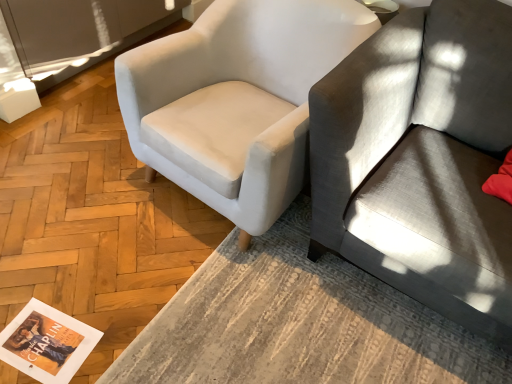
Question: Is gray fabric couch at right taller than textured gray rug at lower center?

Choices:
 (A) no
 (B) yes

Answer: (B)

Question: Is gray fabric couch at right thinner than textured gray rug at lower center?

Choices:
 (A) yes
 (B) no

Answer: (A)

Question: From the image's perspective, is gray fabric couch at right above textured gray rug at lower center?

Choices:
 (A) no
 (B) yes

Answer: (B)

Question: Is gray fabric couch at right positioned behind textured gray rug at lower center?

Choices:
 (A) no
 (B) yes

Answer: (A)

Question: Considering the relative positions of gray fabric couch at right and textured gray rug at lower center in the image provided, is gray fabric couch at right to the left of textured gray rug at lower center from the viewer's perspective?

Choices:
 (A) yes
 (B) no

Answer: (B)

Question: Are gray fabric couch at right and textured gray rug at lower center located far from each other?

Choices:
 (A) yes
 (B) no

Answer: (B)

Question: Can you see white fabric chair at upper left touching textured gray rug at lower center?

Choices:
 (A) yes
 (B) no

Answer: (B)

Question: Is white fabric chair at upper left taller than textured gray rug at lower center?

Choices:
 (A) no
 (B) yes

Answer: (B)

Question: Is white fabric chair at upper left positioned before textured gray rug at lower center?

Choices:
 (A) no
 (B) yes

Answer: (A)

Question: Is white fabric chair at upper left outside of textured gray rug at lower center?

Choices:
 (A) no
 (B) yes

Answer: (B)

Question: From a real-world perspective, is white fabric chair at upper left on textured gray rug at lower center?

Choices:
 (A) no
 (B) yes

Answer: (B)

Question: Can you confirm if white fabric chair at upper left is thinner than textured gray rug at lower center?

Choices:
 (A) no
 (B) yes

Answer: (B)

Question: Does textured gray rug at lower center have a lesser height compared to matte paper magazine at lower left?

Choices:
 (A) no
 (B) yes

Answer: (A)